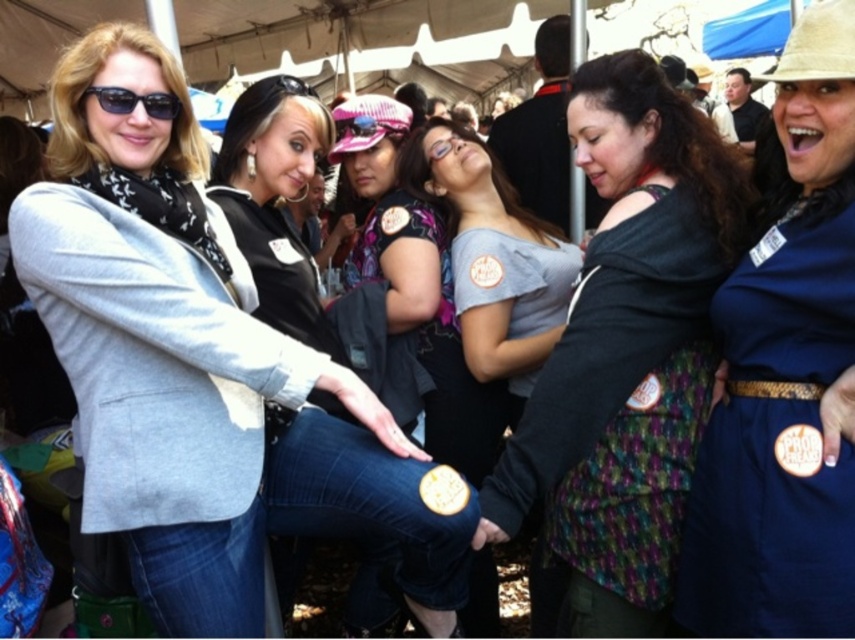
Question: Which point is closer to the camera?

Choices:
 (A) (128, 93)
 (B) (481, 237)

Answer: (A)

Question: Based on their relative distances, which object is nearer to the blue fabric dress at center?

Choices:
 (A) matte gray blazer at left
 (B) black plastic sunglasses at upper left
 (C) gray cotton shirt at center

Answer: (C)

Question: Based on their relative distances, which object is farther from the black plastic sunglasses at upper left?

Choices:
 (A) matte gray blazer at left
 (B) gray cotton shirt at center
 (C) multicolored fabric vest at center

Answer: (B)

Question: Considering the relative positions of matte gray blazer at left and blue fabric dress at center in the image provided, where is matte gray blazer at left located with respect to blue fabric dress at center?

Choices:
 (A) left
 (B) right

Answer: (A)

Question: From the image, what is the correct spatial relationship of matte gray blazer at left in relation to gray cotton shirt at center?

Choices:
 (A) below
 (B) above

Answer: (A)

Question: Can you confirm if gray cotton shirt at center is thinner than black plastic sunglasses at upper left?

Choices:
 (A) yes
 (B) no

Answer: (B)